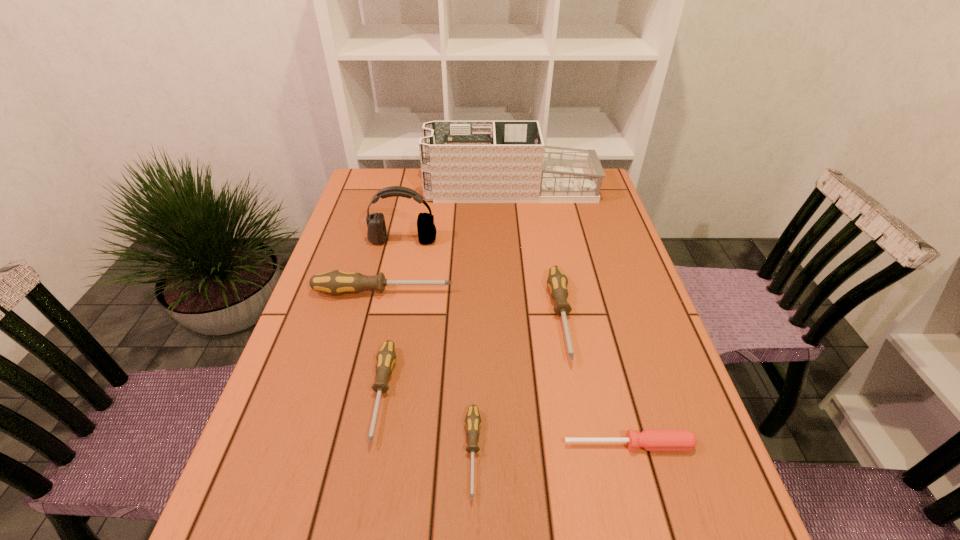
Identify the location of the farthest object. (461, 161).

Find the location of a particular element. Image resolution: width=960 pixels, height=540 pixels. headset is located at coordinates (376, 233).

Identify the location of black headset. The image size is (960, 540). (376, 233).

Locate an element on the screen. The height and width of the screenshot is (540, 960). the fifth shortest object is located at coordinates (336, 282).

In order to click on the biggest gray screwdriver in this screenshot , I will do `click(336, 282)`.

Where is `the rightmost gray screwdriver`? the rightmost gray screwdriver is located at coordinates (557, 282).

Identify the location of the fourth shortest object. (557, 282).

Locate an element on the screen. This screenshot has height=540, width=960. the second smallest gray screwdriver is located at coordinates (386, 357).

Where is `the fifth tallest object`? The height and width of the screenshot is (540, 960). the fifth tallest object is located at coordinates (386, 357).

You are a GUI agent. You are given a task and a screenshot of the screen. Output one action in this format:
    pyautogui.click(x=<x>, y=<y>)
    Task: Click on the red screwdriver
    The height and width of the screenshot is (540, 960).
    Given the screenshot: What is the action you would take?
    pyautogui.click(x=651, y=440)